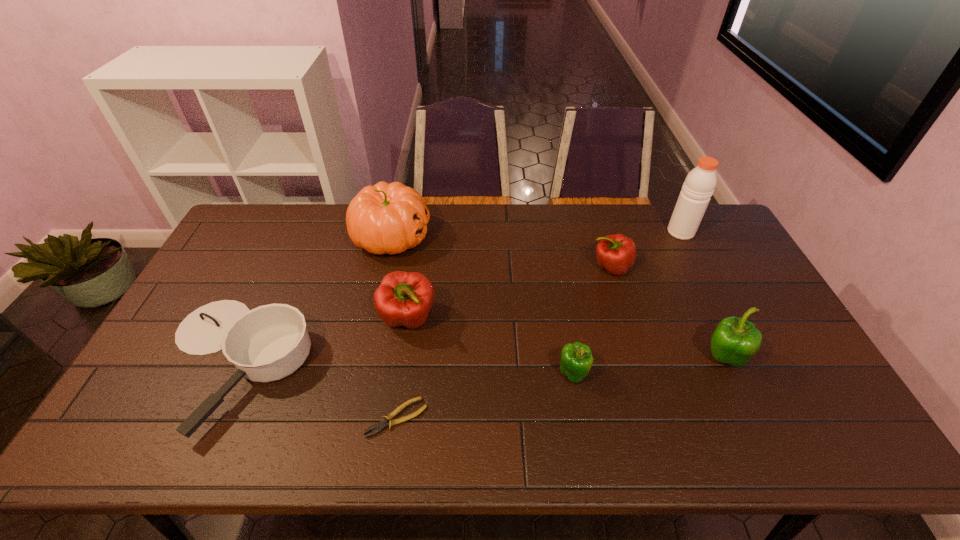
The image size is (960, 540). I want to click on orange shaker, so click(x=699, y=185).

Locate an element on the screen. The image size is (960, 540). shaker is located at coordinates (699, 185).

Where is `pumpkin`? pumpkin is located at coordinates (385, 218).

This screenshot has width=960, height=540. I want to click on the right green bell pepper, so click(735, 340).

The width and height of the screenshot is (960, 540). What are the coordinates of `the bigger green bell pepper` in the screenshot? It's located at (735, 340).

Locate an element on the screen. the nearer pink bell pepper is located at coordinates (403, 298).

Find the location of a particular element. the bigger pink bell pepper is located at coordinates click(x=403, y=298).

Locate an element on the screen. the left green bell pepper is located at coordinates (576, 358).

Locate an element on the screen. This screenshot has width=960, height=540. the smaller green bell pepper is located at coordinates (576, 358).

Find the location of a particular element. This screenshot has width=960, height=540. the sixth object from left to right is located at coordinates (616, 253).